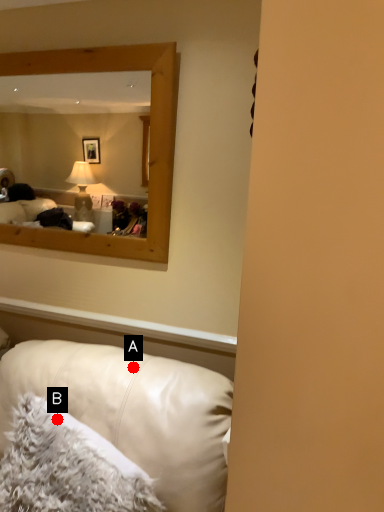
Question: Two points are circled on the image, labeled by A and B beside each circle. Which point is closer to the camera taking this photo?

Choices:
 (A) A is closer
 (B) B is closer

Answer: (B)